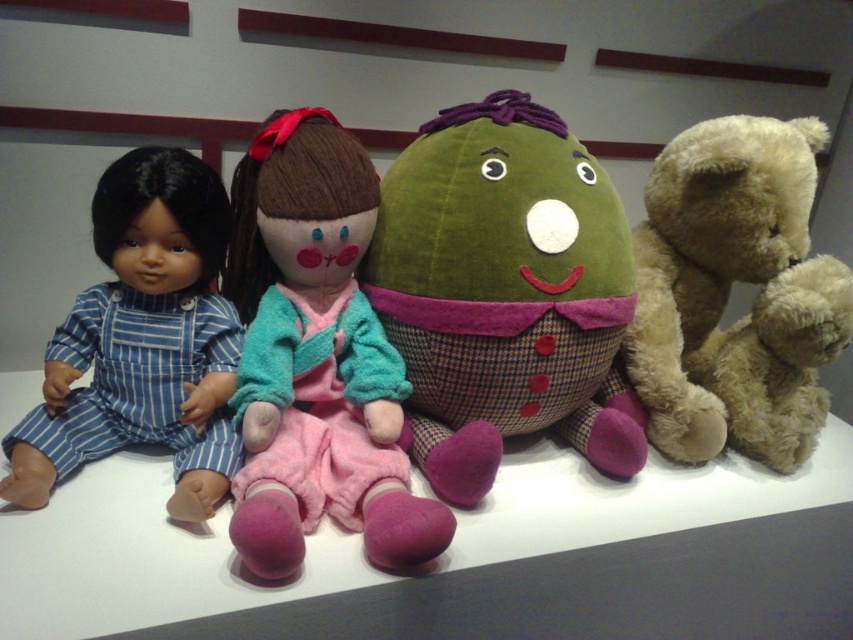
You are organizing a toy shelf and need to place the green velvety plush at center and the light brown plush bear at right. According to their current arrangement, which toy should you place to the left when arranging them in the same order?

The green velvety plush at center should be placed to the left since it is positioned on the left side of the light brown plush bear at right in their current arrangement.

You are organizing a toy shelf and need to place the matte blue striped overalls at left and the light brown plush bear at right. Based on their positions in the image, which toy should be placed closer to the front of the shelf to maintain the original arrangement?

The light brown plush bear at right should be placed closer to the front of the shelf because the matte blue striped overalls at left is behind it in the original image.

You are a child trying to stack the green velvety plush at center and the velvety pink dress at center on top of each other. Which one should you place at the bottom to ensure stability?

The green velvety plush at center should be placed at the bottom because it is taller than the velvety pink dress at center, providing a more stable base.